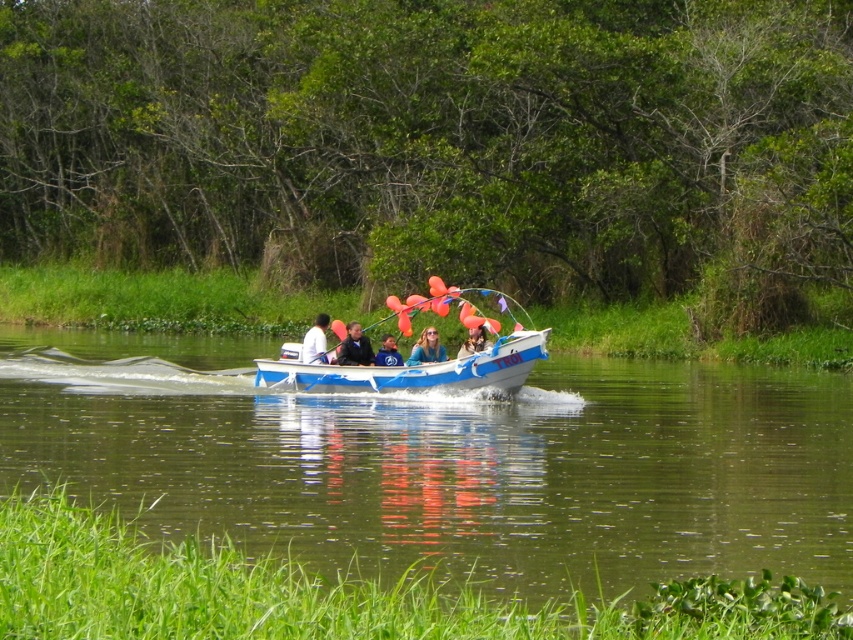
What do you see at coordinates (474, 342) in the screenshot? Image resolution: width=853 pixels, height=640 pixels. I see `matte blue boat at center` at bounding box center [474, 342].

Describe the element at coordinates (474, 342) in the screenshot. I see `matte blue boat at center` at that location.

Find the location of a particular element. This screenshot has width=853, height=640. matte blue boat at center is located at coordinates (474, 342).

Can you confirm if blue plastic boat at center is wider than white fabric shirt at center?

Yes, blue plastic boat at center is wider than white fabric shirt at center.

Is point (418, 564) farther from viewer compared to point (318, 330)?

No, it is not.

Locate an element on the screen. This screenshot has width=853, height=640. blue plastic boat at center is located at coordinates (447, 464).

Can you confirm if blue plastic boat at center is positioned to the right of matte blue boat at center?

No, blue plastic boat at center is not to the right of matte blue boat at center.

This screenshot has width=853, height=640. In order to click on blue plastic boat at center in this screenshot , I will do `click(447, 464)`.